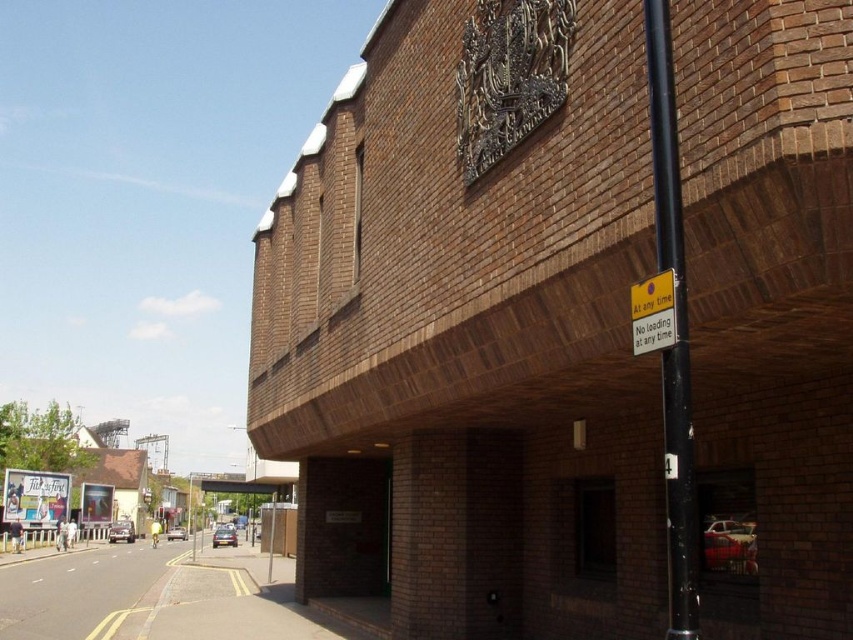
Question: Does black metal pole at right appear under yellow plastic sign at upper right?

Choices:
 (A) yes
 (B) no

Answer: (B)

Question: Is black metal pole at right to the left of yellow plastic sign at upper right from the viewer's perspective?

Choices:
 (A) no
 (B) yes

Answer: (A)

Question: Which point is farther to the camera?

Choices:
 (A) black metal pole at right
 (B) yellow plastic sign at upper right

Answer: (B)

Question: Is black metal pole at right bigger than yellow plastic sign at upper right?

Choices:
 (A) yes
 (B) no

Answer: (A)

Question: Which of the following is the farthest from the observer?

Choices:
 (A) yellow plastic sign at upper right
 (B) black metal pole at right

Answer: (A)